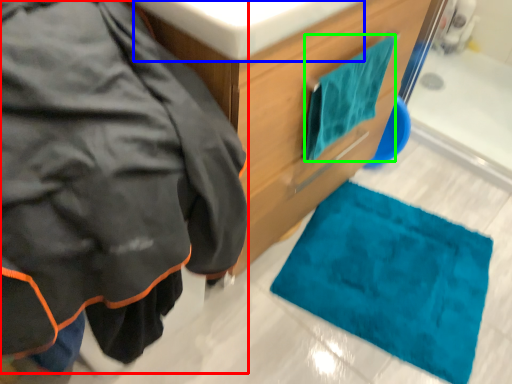
Question: Considering the real-world distances, which object is closest to jacket (highlighted by a red box)? sink (highlighted by a blue box) or towel/napkin (highlighted by a green box).

Choices:
 (A) sink
 (B) towel/napkin

Answer: (A)